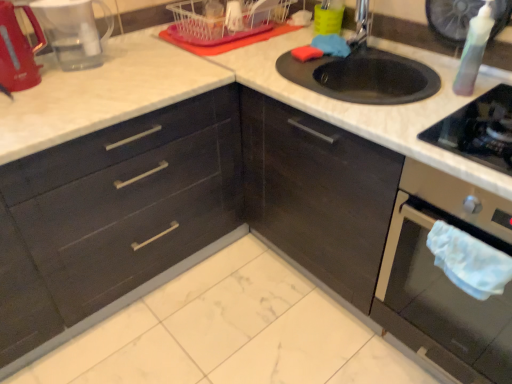
Where is `free space between metallic red kettle at left, the 1th appliance from the left, and red plastic coffee maker at upper left`? This screenshot has height=384, width=512. free space between metallic red kettle at left, the 1th appliance from the left, and red plastic coffee maker at upper left is located at coordinates (69, 77).